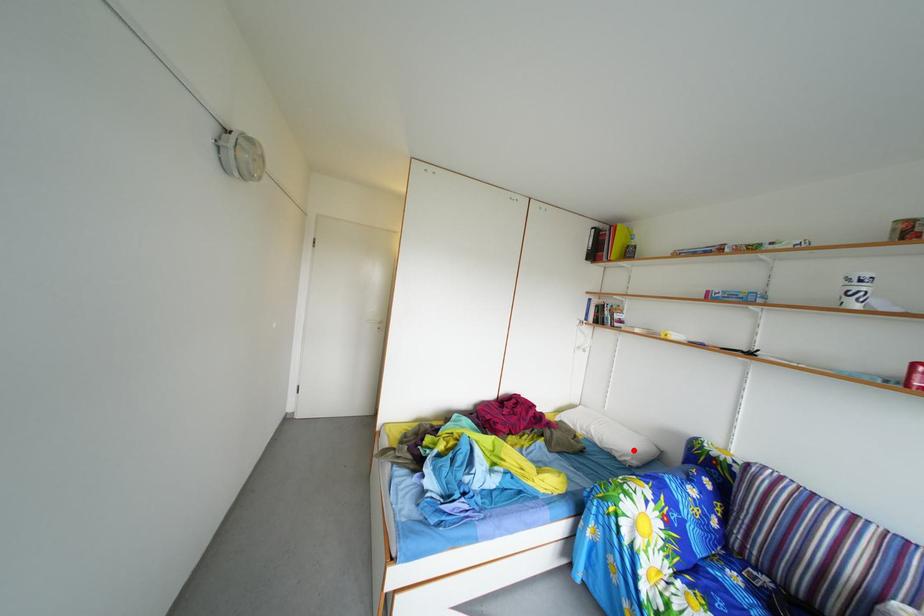
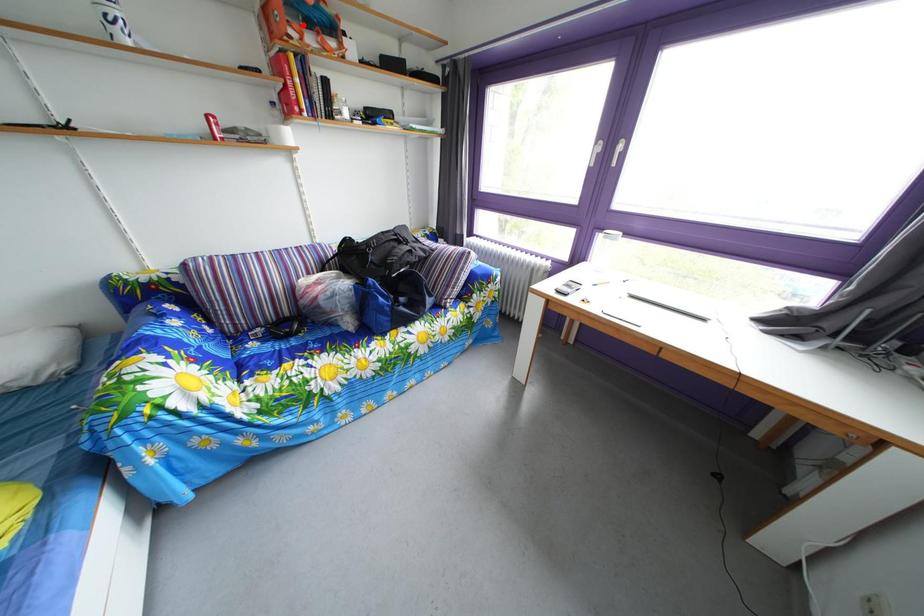
I am providing you with two images of the same scene from different viewpoints. A red point is marked on the first image and another point is marked on the second image. Does the point marked in image1 correspond to the same location as the one in image2?

No